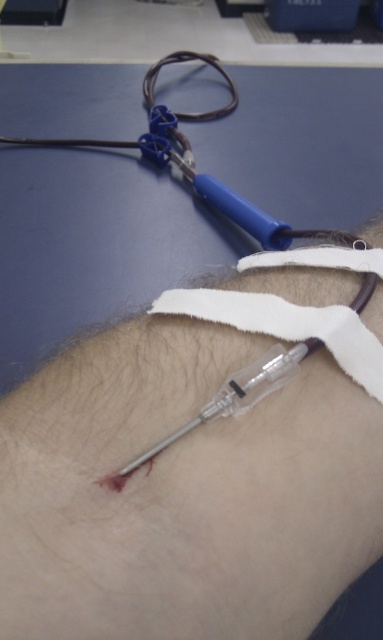
You are a nurse preparing to adjust the position of the white fabric strap at lower center and the transparent plastic syringe at lower center during a blood draw. Based on their positions, which object is easier to reach without moving your hand?

The white fabric strap at lower center is closer to the viewer than the transparent plastic syringe at lower center, so it is easier to reach without moving your hand.

You are a nurse preparing to adjust the position of the white fabric strap at lower center and the transparent plastic syringe at lower center during a blood draw. Which object needs to be lowered to avoid obstruction?

The white fabric strap at lower center needs to be lowered because it is much taller than the transparent plastic syringe at lower center and could be obstructing access to the syringe.

Based on the scene description, can the clear plastic needle at center fit through the opening of the white fabric strap at lower center?

The clear plastic needle at center might be wider than white fabric strap at lower center, so it may not fit through the opening.